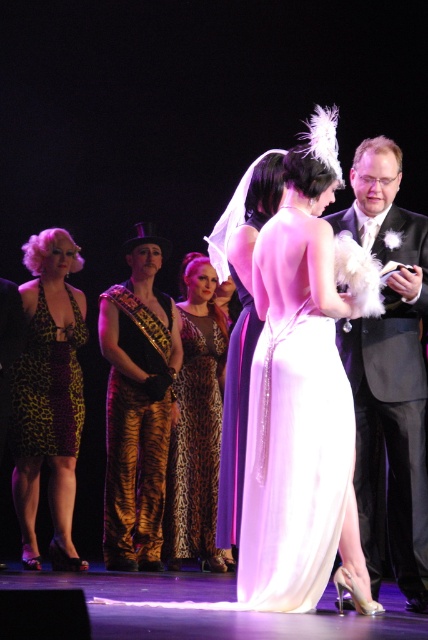
Question: Estimate the real-world distances between objects in this image. Which object is farther from the satin purple dress at center?

Choices:
 (A) leopard print dress at left
 (B) tiger print pants at left

Answer: (A)

Question: Can you confirm if leopard print dress at center is positioned above satin purple dress at center?

Choices:
 (A) no
 (B) yes

Answer: (A)

Question: Which point is farther from the camera taking this photo?

Choices:
 (A) (312, 419)
 (B) (85, 339)

Answer: (B)

Question: Is purple satin dress at center further to the viewer compared to satin purple dress at center?

Choices:
 (A) no
 (B) yes

Answer: (A)

Question: Does shiny black suit at right appear under leopard print fabric dress at left?

Choices:
 (A) no
 (B) yes

Answer: (B)

Question: Among these points, which one is farthest from the camera?

Choices:
 (A) 73,320
 (B) 208,540

Answer: (B)